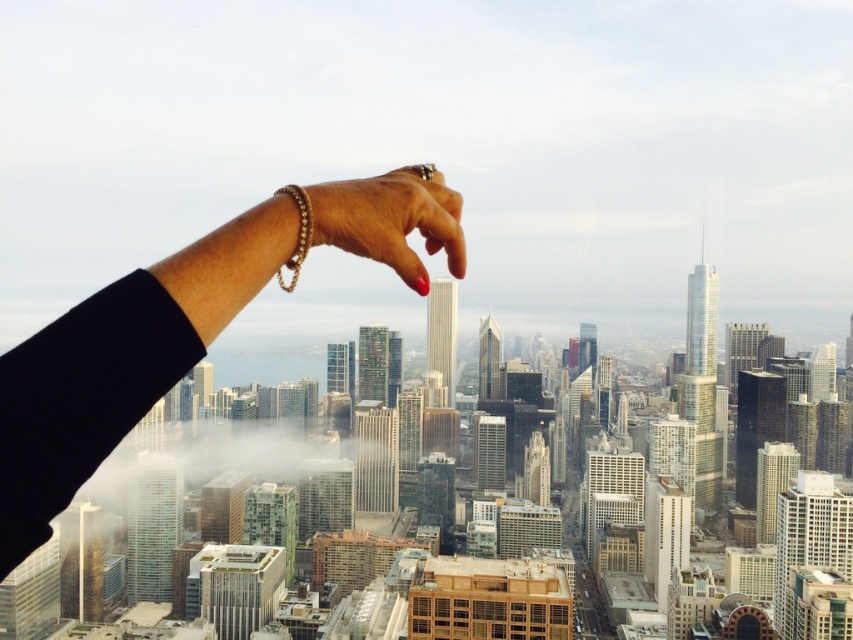
Question: Is gold chain bracelet at upper center in front of gold metallic bracelet at upper center?

Choices:
 (A) yes
 (B) no

Answer: (B)

Question: Does gold chain bracelet at upper center lie behind gold metallic bracelet at upper center?

Choices:
 (A) yes
 (B) no

Answer: (A)

Question: Which object is farther from the camera taking this photo?

Choices:
 (A) gold metallic bracelet at upper center
 (B) gold chain bracelet at upper center

Answer: (B)

Question: Is gold chain bracelet at upper center smaller than gold metallic bracelet at upper center?

Choices:
 (A) no
 (B) yes

Answer: (A)

Question: Which point is closer to the camera?

Choices:
 (A) gold chain bracelet at upper center
 (B) gold metallic bracelet at upper center

Answer: (B)